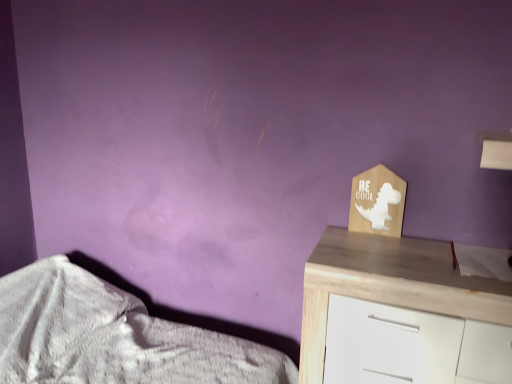
Question: Considering the positions of white textured fabric at lower left and wooden chest of drawers at right in the image, is white textured fabric at lower left taller or shorter than wooden chest of drawers at right?

Choices:
 (A) tall
 (B) short

Answer: (B)

Question: Considering the relative positions of white textured fabric at lower left and wooden chest of drawers at right in the image provided, is white textured fabric at lower left to the left or to the right of wooden chest of drawers at right?

Choices:
 (A) left
 (B) right

Answer: (A)

Question: Is point (206, 337) positioned closer to the camera than point (382, 241)?

Choices:
 (A) closer
 (B) farther

Answer: (B)

Question: In the image, is wooden chest of drawers at right on the left side or the right side of white textured fabric at lower left?

Choices:
 (A) left
 (B) right

Answer: (B)

Question: Considering the positions of wooden chest of drawers at right and white textured fabric at lower left in the image, is wooden chest of drawers at right wider or thinner than white textured fabric at lower left?

Choices:
 (A) thin
 (B) wide

Answer: (A)

Question: From the image's perspective, is wooden chest of drawers at right positioned above or below white textured fabric at lower left?

Choices:
 (A) above
 (B) below

Answer: (A)

Question: From their relative heights in the image, would you say wooden chest of drawers at right is taller or shorter than white textured fabric at lower left?

Choices:
 (A) short
 (B) tall

Answer: (B)